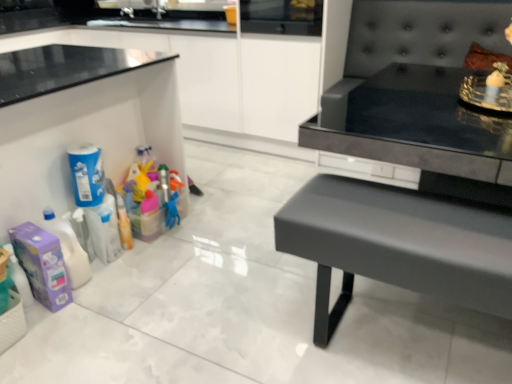
This screenshot has height=384, width=512. What do you see at coordinates (220, 74) in the screenshot? I see `white glossy cabinetry at upper left` at bounding box center [220, 74].

This screenshot has height=384, width=512. In order to click on blue matte cleaning product at left, which ranks as the 2th cleaning product in bottom-to-top order in this screenshot , I will do `click(87, 175)`.

At what (x,y) coordinates should I click in order to perform the action: click on white woven basket at lower left. Please return your answer as a coordinate pair (x, y). This screenshot has height=384, width=512. Looking at the image, I should click on (12, 322).

Describe the element at coordinates (42, 265) in the screenshot. I see `purple cardboard box at lower left, which is the second cleaning product from top to bottom` at that location.

Locate an element on the screen. white glossy cabinetry at upper left is located at coordinates click(220, 74).

What's the angular difference between white woven basket at lower left and white glossy cabinetry at upper left's facing directions?

They differ by 90 degrees in their facing directions.

Considering the relative sizes of white woven basket at lower left and white glossy cabinetry at upper left in the image provided, is white woven basket at lower left bigger than white glossy cabinetry at upper left?

No.

From a real-world perspective, who is located lower, white woven basket at lower left or white glossy cabinetry at upper left?

white woven basket at lower left, from a real-world perspective.

Which of these two, white woven basket at lower left or white glossy cabinetry at upper left, is wider?

white glossy cabinetry at upper left is wider.

Could you tell me if purple cardboard box at lower left, which is the second cleaning product from top to bottom, is turned towards matte black bench at right?

No, purple cardboard box at lower left, which is the second cleaning product from top to bottom, is not turned towards matte black bench at right.

Consider the image. Can you confirm if purple cardboard box at lower left, which is the 1th cleaning product from bottom to top, is shorter than matte black bench at right?

Yes.

Which of these two, purple cardboard box at lower left, which is the 1th cleaning product from bottom to top, or matte black bench at right, is wider?

matte black bench at right.

Which of these two, purple cardboard box at lower left, which is the 1th cleaning product from bottom to top, or matte black bench at right, is bigger?

With larger size is matte black bench at right.

Which object is closer to the camera taking this photo, matte black bench at right or white glossy cabinetry at upper left?

matte black bench at right is in front.

At what (x,y) coordinates should I click in order to perform the action: click on table below the white glossy cabinetry at upper left (from the image's perspective). Please return your answer as a coordinate pair (x, y). Looking at the image, I should click on coord(396,245).

How far apart are matte black bench at right and white glossy cabinetry at upper left?

A distance of 5.80 feet exists between matte black bench at right and white glossy cabinetry at upper left.

In the scene shown: Is white woven basket at lower left looking in the opposite direction of purple cardboard box at lower left, which is the second cleaning product from top to bottom?

No, white woven basket at lower left is not facing away from purple cardboard box at lower left, which is the second cleaning product from top to bottom.

Does white woven basket at lower left have a greater width compared to purple cardboard box at lower left, which is the 1th cleaning product from bottom to top?

No.

Which is closer to the camera, (0,335) or (45,255)?

The point (0,335) is more forward.

Where is `basket located on the left of purple cardboard box at lower left, which is the 1th cleaning product from bottom to top`? The image size is (512, 384). basket located on the left of purple cardboard box at lower left, which is the 1th cleaning product from bottom to top is located at coordinates (12, 322).

Is matte black bench at right wider than blue matte cleaning product at left, which ranks as the 2th cleaning product in bottom-to-top order?

Yes, matte black bench at right is wider than blue matte cleaning product at left, which ranks as the 2th cleaning product in bottom-to-top order.

Based on their sizes in the image, would you say matte black bench at right is bigger or smaller than blue matte cleaning product at left, which ranks as the 2th cleaning product in bottom-to-top order?

Clearly, matte black bench at right is larger in size than blue matte cleaning product at left, which ranks as the 2th cleaning product in bottom-to-top order.

Which of these two, matte black bench at right or blue matte cleaning product at left, which appears as the 1th cleaning product when viewed from the top, stands taller?

matte black bench at right is taller.

Is there a large distance between matte black bench at right and blue matte cleaning product at left, which appears as the 1th cleaning product when viewed from the top?

That's right, there is a large distance between matte black bench at right and blue matte cleaning product at left, which appears as the 1th cleaning product when viewed from the top.

Looking at their sizes, would you say blue matte cleaning product at left, which appears as the 1th cleaning product when viewed from the top, is wider or thinner than purple cardboard box at lower left, which is the 1th cleaning product from bottom to top?

Considering their sizes, blue matte cleaning product at left, which appears as the 1th cleaning product when viewed from the top, looks slimmer than purple cardboard box at lower left, which is the 1th cleaning product from bottom to top.

Can you tell me how much blue matte cleaning product at left, which ranks as the 2th cleaning product in bottom-to-top order, and purple cardboard box at lower left, which is the second cleaning product from top to bottom, differ in facing direction?

10.8 degrees.

Would you say purple cardboard box at lower left, which is the 1th cleaning product from bottom to top, is part of blue matte cleaning product at left, which appears as the 1th cleaning product when viewed from the top,'s contents?

No, blue matte cleaning product at left, which appears as the 1th cleaning product when viewed from the top, does not contain purple cardboard box at lower left, which is the 1th cleaning product from bottom to top.

Is blue matte cleaning product at left, which appears as the 1th cleaning product when viewed from the top, turned away from purple cardboard box at lower left, which is the second cleaning product from top to bottom?

That's not correct — blue matte cleaning product at left, which appears as the 1th cleaning product when viewed from the top, is not looking away from purple cardboard box at lower left, which is the second cleaning product from top to bottom.

From a real-world perspective, is white glossy cabinetry at upper left above or below purple cardboard box at lower left, which is the second cleaning product from top to bottom?

In terms of real-world spatial position, white glossy cabinetry at upper left is above purple cardboard box at lower left, which is the second cleaning product from top to bottom.

Considering the sizes of objects white glossy cabinetry at upper left and purple cardboard box at lower left, which is the 1th cleaning product from bottom to top, in the image provided, who is taller, white glossy cabinetry at upper left or purple cardboard box at lower left, which is the 1th cleaning product from bottom to top,?

white glossy cabinetry at upper left.

Find the location of a particular element. The width and height of the screenshot is (512, 384). cabinetry above the purple cardboard box at lower left, which is the 1th cleaning product from bottom to top (from the image's perspective) is located at coordinates (220, 74).

Does white glossy cabinetry at upper left lie in front of purple cardboard box at lower left, which is the second cleaning product from top to bottom?

No, white glossy cabinetry at upper left is further to the viewer.

I want to click on cabinetry on the right of white woven basket at lower left, so click(x=220, y=74).

Where is `cleaning product that is below the matte black bench at right (from the image's perspective)`? cleaning product that is below the matte black bench at right (from the image's perspective) is located at coordinates (42, 265).

From the image, which object appears to be farther from white glossy cabinetry at upper left, matte black bench at right or purple cardboard box at lower left, which is the second cleaning product from top to bottom?

purple cardboard box at lower left, which is the second cleaning product from top to bottom, is further to white glossy cabinetry at upper left.

When comparing their distances from matte black bench at right, does white woven basket at lower left or white glossy cabinetry at upper left seem further?

white glossy cabinetry at upper left.

From the image, which object appears to be farther from purple cardboard box at lower left, which is the 1th cleaning product from bottom to top, matte black bench at right or white woven basket at lower left?

Based on the image, matte black bench at right appears to be further to purple cardboard box at lower left, which is the 1th cleaning product from bottom to top.

From the picture: Based on their spatial positions, is blue matte cleaning product at left, which ranks as the 2th cleaning product in bottom-to-top order, or white glossy cabinetry at upper left further from purple cardboard box at lower left, which is the second cleaning product from top to bottom?

white glossy cabinetry at upper left is positioned further to the anchor purple cardboard box at lower left, which is the second cleaning product from top to bottom.

Estimate the real-world distances between objects in this image. Which object is closer to blue matte cleaning product at left, which ranks as the 2th cleaning product in bottom-to-top order, white woven basket at lower left or white glossy cabinetry at upper left?

white woven basket at lower left.

When comparing their distances from matte black bench at right, does white woven basket at lower left or purple cardboard box at lower left, which is the 1th cleaning product from bottom to top, seem further?

Based on the image, white woven basket at lower left appears to be further to matte black bench at right.

When comparing their distances from matte black bench at right, does blue matte cleaning product at left, which ranks as the 2th cleaning product in bottom-to-top order, or white woven basket at lower left seem closer?

blue matte cleaning product at left, which ranks as the 2th cleaning product in bottom-to-top order, is positioned closer to the anchor matte black bench at right.

Which object lies nearer to the anchor point white glossy cabinetry at upper left, blue matte cleaning product at left, which appears as the 1th cleaning product when viewed from the top, or purple cardboard box at lower left, which is the second cleaning product from top to bottom?

Among the two, blue matte cleaning product at left, which appears as the 1th cleaning product when viewed from the top, is located nearer to white glossy cabinetry at upper left.

Locate an element on the screen. cleaning product between purple cardboard box at lower left, which is the second cleaning product from top to bottom, and matte black bench at right is located at coordinates (87, 175).

Where is `cleaning product between blue matte cleaning product at left, which ranks as the 2th cleaning product in bottom-to-top order, and white woven basket at lower left from top to bottom`? cleaning product between blue matte cleaning product at left, which ranks as the 2th cleaning product in bottom-to-top order, and white woven basket at lower left from top to bottom is located at coordinates (42, 265).

What are the coordinates of `basket located between matte black bench at right and white glossy cabinetry at upper left in the depth direction` in the screenshot? It's located at (12, 322).

Where is `cleaning product between white glossy cabinetry at upper left and purple cardboard box at lower left, which is the 1th cleaning product from bottom to top, in the vertical direction`? The image size is (512, 384). cleaning product between white glossy cabinetry at upper left and purple cardboard box at lower left, which is the 1th cleaning product from bottom to top, in the vertical direction is located at coordinates (87, 175).